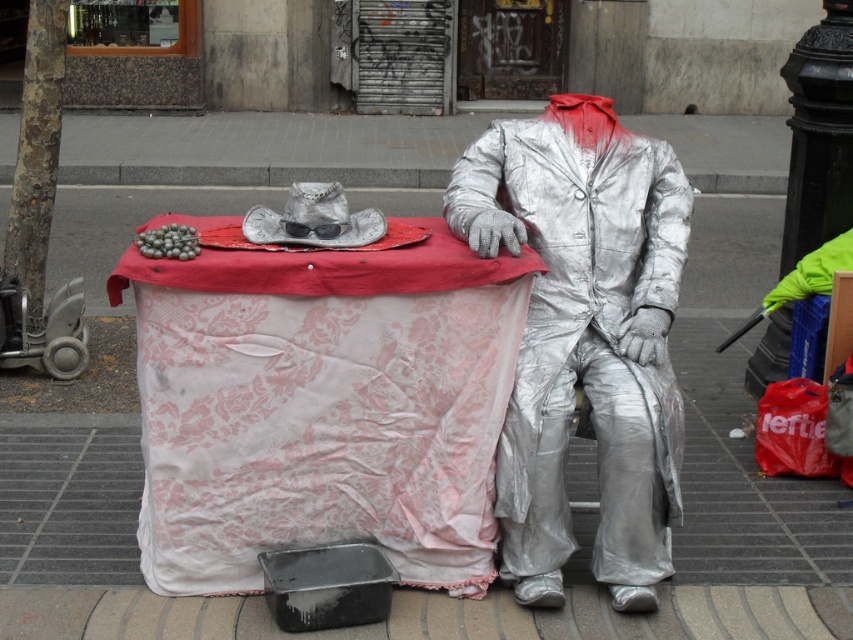
Is point (358, 472) positioned after point (607, 166)?

No.

Measure the distance between pink lace table at center and shiny metallic suit at center.

pink lace table at center is 46.65 centimeters from shiny metallic suit at center.

Describe the element at coordinates (322, 406) in the screenshot. This screenshot has height=640, width=853. I see `pink lace table at center` at that location.

The width and height of the screenshot is (853, 640). I want to click on pink lace table at center, so click(x=322, y=406).